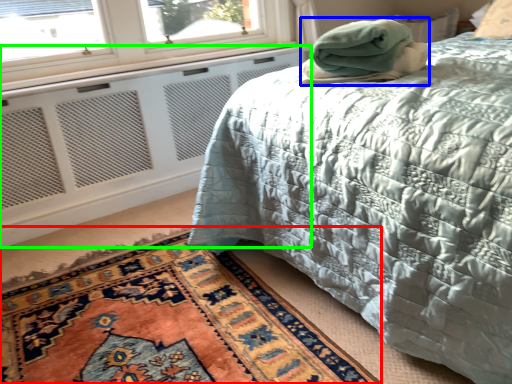
Question: Which is farther away from mat (highlighted by a red box)? blanket (highlighted by a blue box) or radiator (highlighted by a green box)?

Choices:
 (A) blanket
 (B) radiator

Answer: (B)